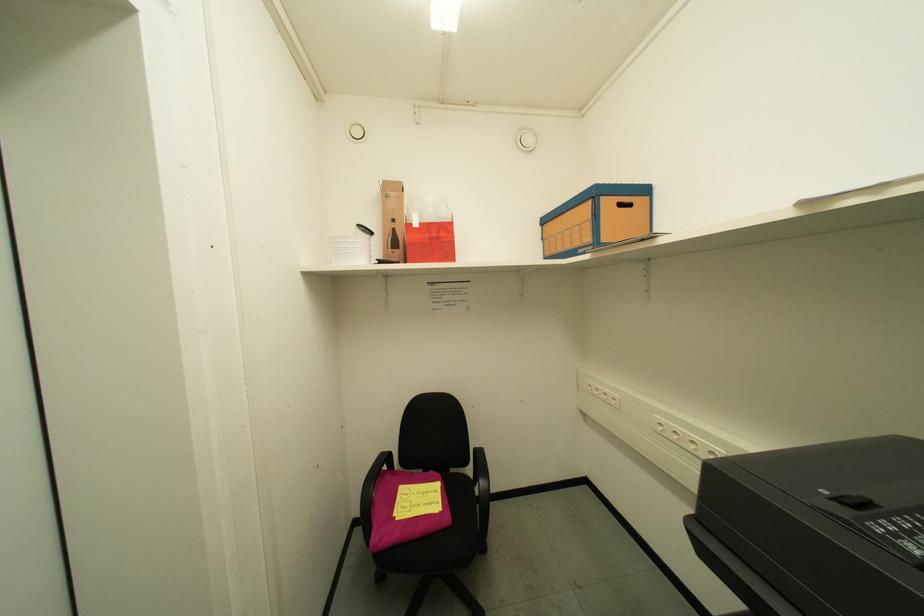
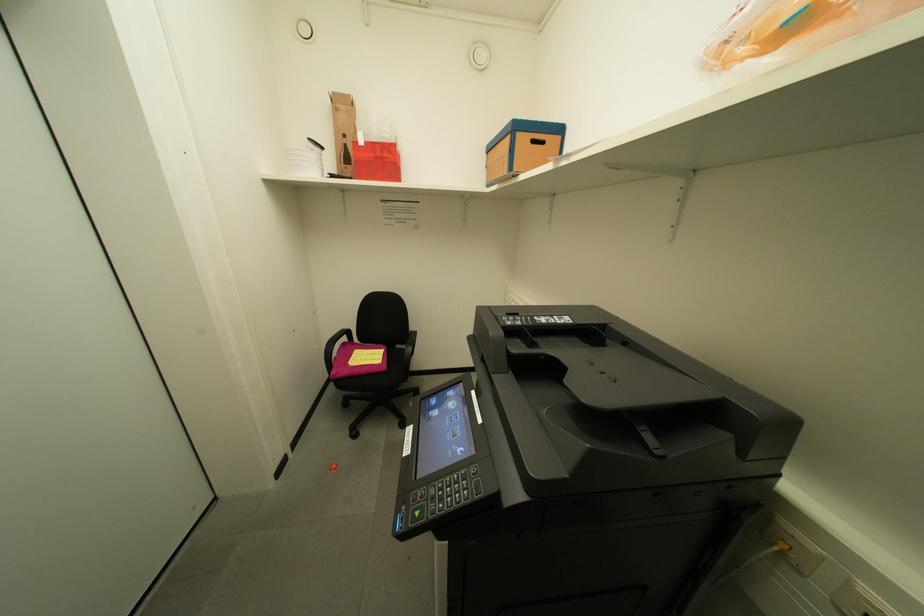
Question: How did the camera likely rotate?

Choices:
 (A) Left
 (B) Right
 (C) Up
 (D) Down

Answer: (D)